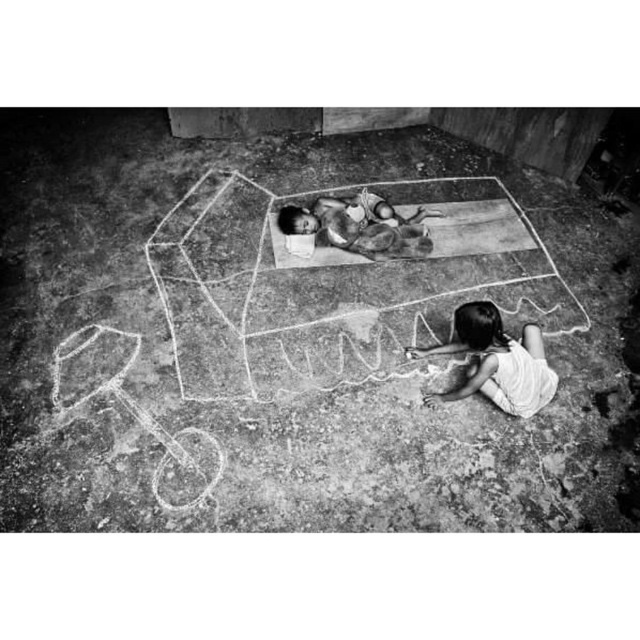
Question: Is smooth white shirt at lower right bigger than smooth skin child at center?

Choices:
 (A) no
 (B) yes

Answer: (B)

Question: Which point is closer to the camera taking this photo?

Choices:
 (A) (550, 374)
 (B) (307, 224)

Answer: (A)

Question: Does smooth white shirt at lower right appear under smooth skin child at center?

Choices:
 (A) no
 (B) yes

Answer: (B)

Question: Is smooth white shirt at lower right wider than smooth skin child at center?

Choices:
 (A) yes
 (B) no

Answer: (B)

Question: Which point appears farthest from the camera in this image?

Choices:
 (A) (513, 416)
 (B) (346, 228)

Answer: (B)